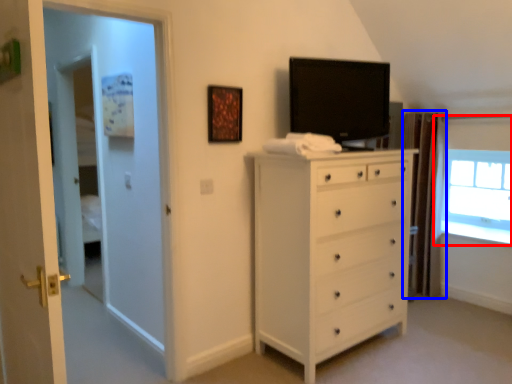
Question: Among these objects, which one is nearest to the camera, window (highlighted by a red box) or curtain (highlighted by a blue box)?

Choices:
 (A) window
 (B) curtain

Answer: (B)